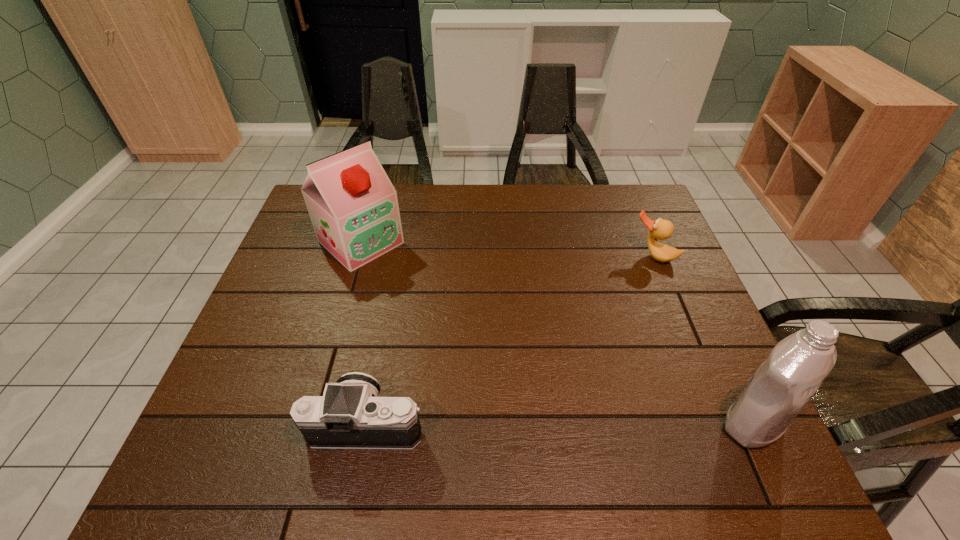
This screenshot has height=540, width=960. I want to click on free spot on the desktop that is between the camera and the detergent and is positioned on the beak of the shortest object, so click(553, 423).

You are a GUI agent. You are given a task and a screenshot of the screen. Output one action in this format:
    pyautogui.click(x=<x>, y=<y>)
    Task: Click on the vacant space on the desktop that is between the camera and the detergent and is positioned with the cap open on the soya milk
    
    Given the screenshot: What is the action you would take?
    pyautogui.click(x=568, y=423)